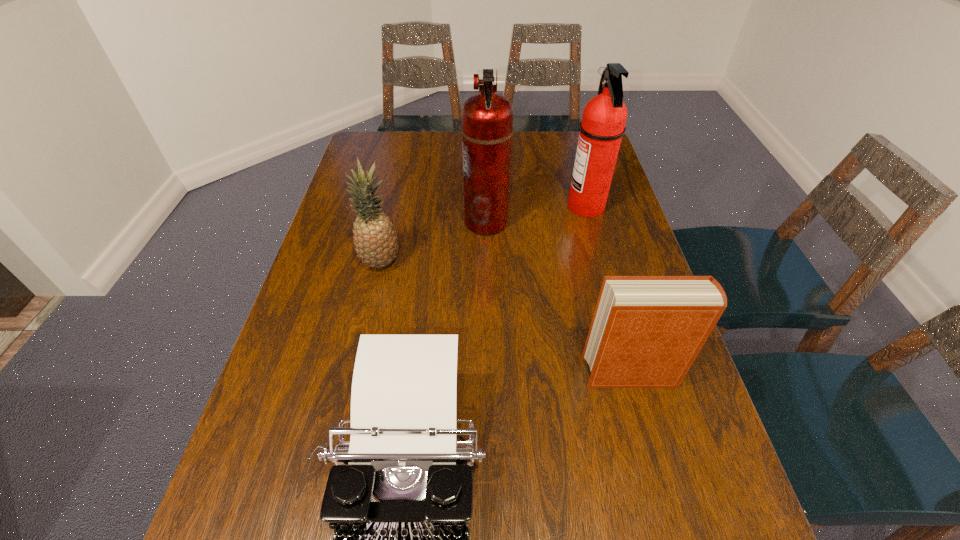
Where is `free space located on the front of the pineapple`? free space located on the front of the pineapple is located at coordinates (356, 370).

Locate an element on the screen. vacant space located on the open cover of the hardback book is located at coordinates pos(510,373).

I want to click on free spot located on the open cover of the hardback book, so click(426, 373).

At what (x,y) coordinates should I click in order to perform the action: click on free space located on the open cover of the hardback book. Please return your answer as a coordinate pair (x, y). Image resolution: width=960 pixels, height=540 pixels. Looking at the image, I should click on (546, 373).

This screenshot has width=960, height=540. In order to click on object located at the left edge in this screenshot , I will do `click(375, 239)`.

Locate an element on the screen. This screenshot has width=960, height=540. fire extinguisher located in the right edge section of the desktop is located at coordinates (602, 126).

I want to click on hardback book at the right edge, so click(646, 331).

Locate an element on the screen. The height and width of the screenshot is (540, 960). vacant space at the far edge of the desktop is located at coordinates (433, 143).

In the image, there is a desktop. Where is `vacant space at the left edge`? vacant space at the left edge is located at coordinates (288, 432).

Locate an element on the screen. vacant space at the right edge is located at coordinates (614, 248).